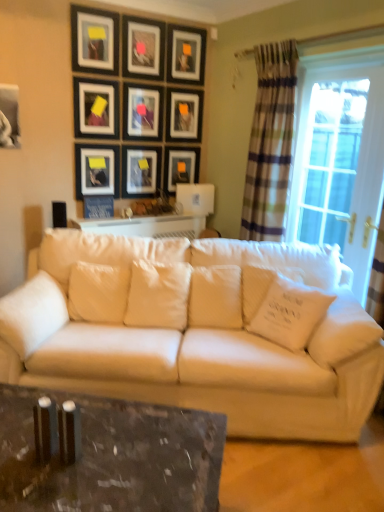
Question: Considering the relative positions of white fabric pillow at center, acting as the 4th pillow starting from the right, and matte black picture frame at upper center, which is the 9th picture frame in bottom-to-top order, in the image provided, is white fabric pillow at center, acting as the 4th pillow starting from the right, in front of matte black picture frame at upper center, which is the 9th picture frame in bottom-to-top order,?

Choices:
 (A) no
 (B) yes

Answer: (B)

Question: From the image's perspective, does white fabric pillow at center, acting as the 4th pillow starting from the right, appear higher than matte black picture frame at upper center, which is the 9th picture frame in bottom-to-top order?

Choices:
 (A) yes
 (B) no

Answer: (B)

Question: Is white fabric pillow at center, which is the second pillow from left to right, positioned with its back to matte black picture frame at upper center, which is the 9th picture frame in bottom-to-top order?

Choices:
 (A) yes
 (B) no

Answer: (B)

Question: Does white fabric pillow at center, acting as the 4th pillow starting from the right, have a smaller size compared to matte black picture frame at upper center, the second picture frame positioned from the top?

Choices:
 (A) no
 (B) yes

Answer: (A)

Question: From a real-world perspective, does white fabric pillow at center, acting as the 4th pillow starting from the right, sit lower than matte black picture frame at upper center, the second picture frame positioned from the top?

Choices:
 (A) yes
 (B) no

Answer: (A)

Question: Can you confirm if white fabric pillow at center, which is the second pillow from left to right, is taller than matte black picture frame at upper center, the second picture frame positioned from the top?

Choices:
 (A) yes
 (B) no

Answer: (A)

Question: From a real-world perspective, is white fabric pillow at center, which is the second pillow from left to right, positioned under matte black picture frame at upper center, the sixth picture frame in the top-to-bottom sequence, based on gravity?

Choices:
 (A) yes
 (B) no

Answer: (A)

Question: Is the position of white fabric pillow at center, acting as the 4th pillow starting from the right, more distant than that of matte black picture frame at upper center, which is counted as the 5th picture frame, starting from the bottom?

Choices:
 (A) yes
 (B) no

Answer: (B)

Question: Considering the relative sizes of white fabric pillow at center, acting as the 4th pillow starting from the right, and matte black picture frame at upper center, the sixth picture frame in the top-to-bottom sequence, in the image provided, is white fabric pillow at center, acting as the 4th pillow starting from the right, wider than matte black picture frame at upper center, the sixth picture frame in the top-to-bottom sequence,?

Choices:
 (A) no
 (B) yes

Answer: (B)

Question: Are white fabric pillow at center, acting as the 4th pillow starting from the right, and matte black picture frame at upper center, the sixth picture frame in the top-to-bottom sequence, located far from each other?

Choices:
 (A) no
 (B) yes

Answer: (B)

Question: From the image's perspective, is white fabric pillow at center, which is the second pillow from left to right, beneath matte black picture frame at upper center, which is counted as the 5th picture frame, starting from the bottom?

Choices:
 (A) no
 (B) yes

Answer: (B)

Question: Considering the relative sizes of white fabric pillow at center, which is the second pillow from left to right, and matte black picture frame at upper center, which is counted as the 5th picture frame, starting from the bottom, in the image provided, is white fabric pillow at center, which is the second pillow from left to right, bigger than matte black picture frame at upper center, which is counted as the 5th picture frame, starting from the bottom,?

Choices:
 (A) yes
 (B) no

Answer: (A)

Question: Considering the relative sizes of matte black picture frame at upper left, the 2th picture frame in the bottom-to-top sequence, and matte black picture frame at center, the fourth picture frame ordered from the bottom, in the image provided, is matte black picture frame at upper left, the 2th picture frame in the bottom-to-top sequence, smaller than matte black picture frame at center, the fourth picture frame ordered from the bottom,?

Choices:
 (A) yes
 (B) no

Answer: (B)